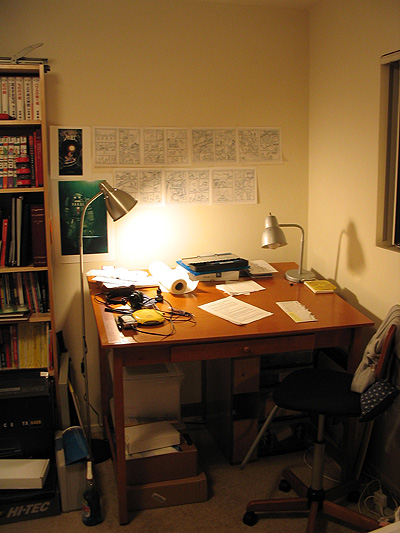
This screenshot has height=533, width=400. Identify the location of window frame. (378, 226).